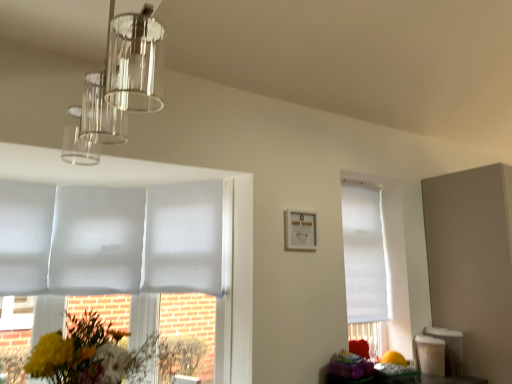
Question: In the image, is white matte blind at left, which appears as the first blind when viewed from the left, positioned in front of or behind white matte blind at left, the third blind from the right?

Choices:
 (A) behind
 (B) front

Answer: (B)

Question: Based on their positions, is white matte blind at left, positioned as the 4th blind in right-to-left order, located to the left or right of white matte blind at left, the third blind from the right?

Choices:
 (A) right
 (B) left

Answer: (B)

Question: Estimate the real-world distances between objects in this image. Which object is closer to the white matte blind at left, the third blind from the right?

Choices:
 (A) matte white picture frame at center
 (B) white matte blind at center, which is the 3th blind in left-to-right order
 (C) fluffy bouquet at lower left
 (D) clear glass pendant light at upper left
 (E) white matte blind at left, positioned as the 4th blind in right-to-left order

Answer: (E)

Question: Based on their relative distances, which object is farther from the matte white picture frame at center?

Choices:
 (A) white matte blind at center, placed as the second blind when sorted from right to left
 (B) white matte blind at left, the third blind from the right
 (C) white matte blind at left, which appears as the first blind when viewed from the left
 (D) clear glass pendant light at upper left
 (E) white matte blind at right, placed as the fourth blind when sorted from left to right

Answer: (C)